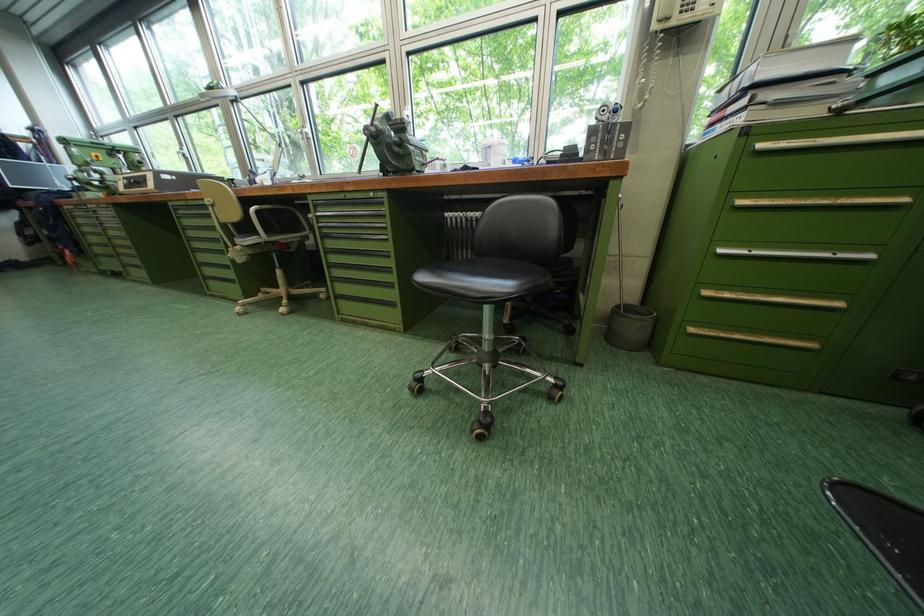
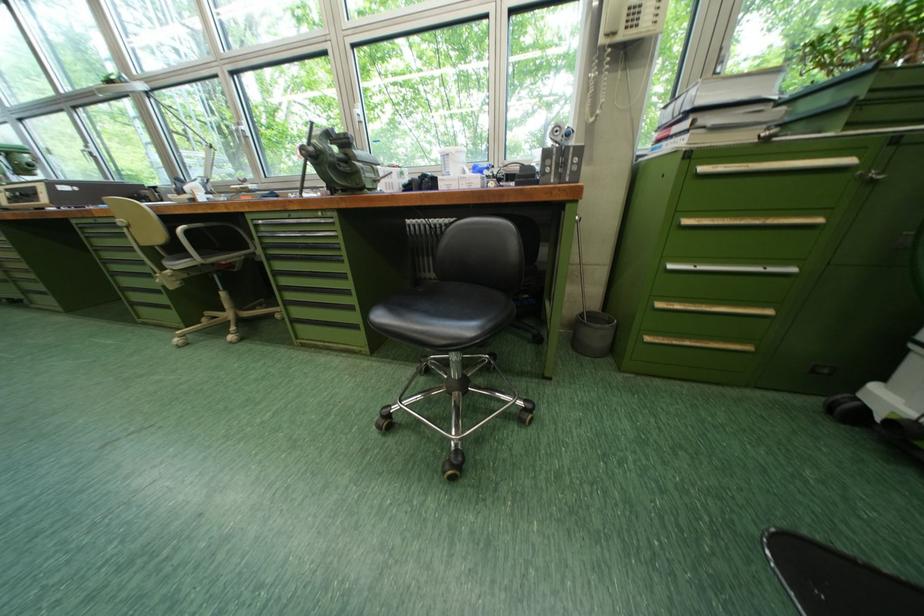
In the second image, find the point that corresponds to [625,307] in the first image.

(589, 315)